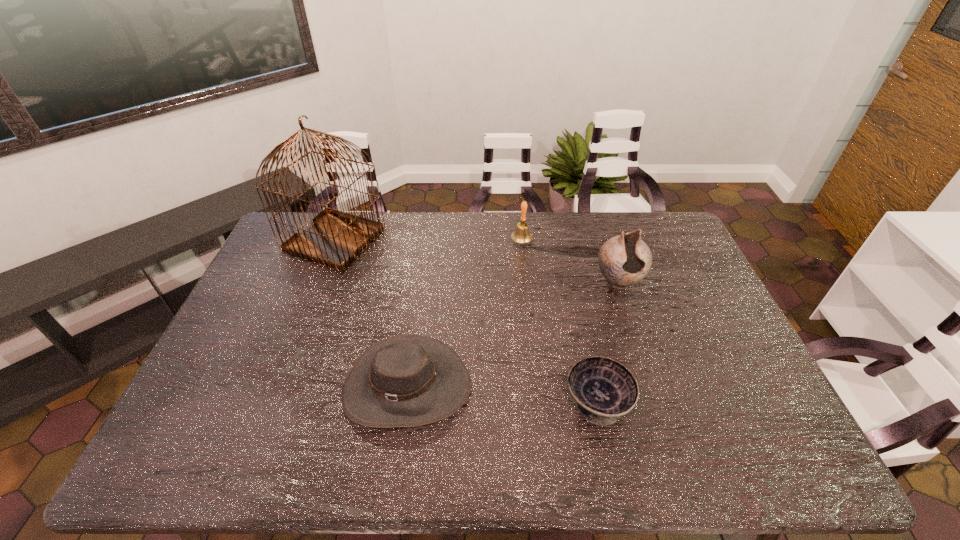
You are a GUI agent. You are given a task and a screenshot of the screen. Output one action in this format:
    pyautogui.click(x=<x>, y=<y>)
    Task: Click on the vacant region located 0.360m on the left of the shortest object
    
    Given the screenshot: What is the action you would take?
    pyautogui.click(x=422, y=402)

At what (x,y) coordinates should I click in order to perform the action: click on birdcage at the far edge. Please return your answer as a coordinate pair (x, y). Looking at the image, I should click on (336, 239).

In order to click on bell located in the far edge section of the desktop in this screenshot , I will do (521, 235).

The width and height of the screenshot is (960, 540). What are the coordinates of `object that is positioned at the near edge` in the screenshot? It's located at click(x=410, y=380).

Locate an element on the screen. object that is at the left edge is located at coordinates (336, 239).

Image resolution: width=960 pixels, height=540 pixels. Find the location of `object present at the far left corner`. object present at the far left corner is located at coordinates (336, 239).

Where is `vacant region at the far edge`? vacant region at the far edge is located at coordinates (439, 212).

Identify the location of free space at the near edge of the desktop. (290, 458).

I want to click on free region at the left edge of the desktop, so click(x=204, y=380).

Find the location of a particular element. vacant region at the right edge of the desktop is located at coordinates (731, 399).